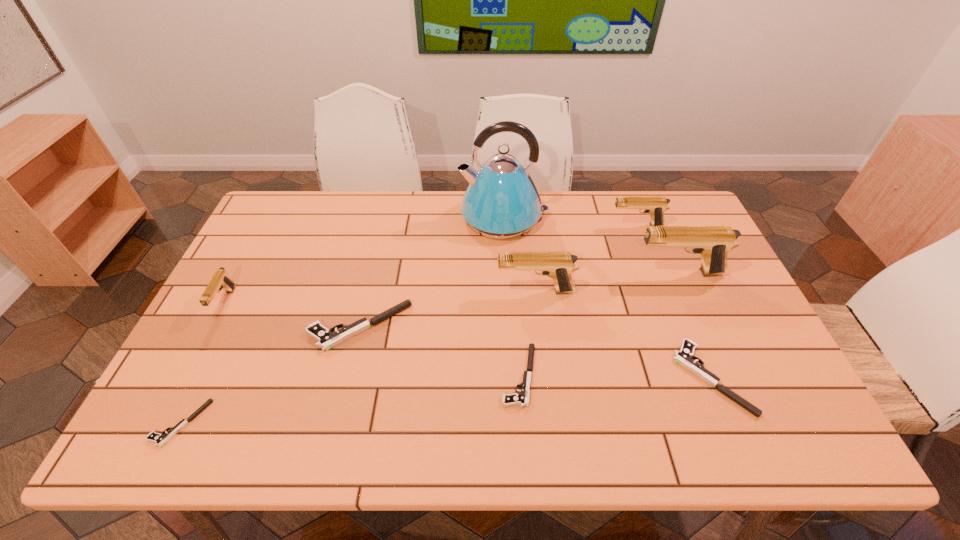
Locate an element on the screen. free space located at the barrel of the biggest tan pistol is located at coordinates (603, 273).

This screenshot has width=960, height=540. Find the location of `vacant space situated at the barrel of the biggest tan pistol`. vacant space situated at the barrel of the biggest tan pistol is located at coordinates (519, 273).

Where is `free spot located 0.080m at the barrel of the biggest tan pistol`? This screenshot has height=540, width=960. free spot located 0.080m at the barrel of the biggest tan pistol is located at coordinates [607, 273].

The height and width of the screenshot is (540, 960). In order to click on free space located at the barrel of the seventh shortest pistol in this screenshot , I will do `click(389, 291)`.

Locate an element on the screen. Image resolution: width=960 pixels, height=540 pixels. free spot located at the barrel of the seventh shortest pistol is located at coordinates (455, 291).

Locate an element on the screen. The width and height of the screenshot is (960, 540). vacant area situated 0.070m at the barrel of the seventh shortest pistol is located at coordinates (472, 291).

Find the location of a particular element. free space located at the barrel of the fourth tallest object is located at coordinates (523, 226).

At what (x,y) coordinates should I click in order to perform the action: click on free space located 0.220m at the barrel of the fourth tallest object. Please return your answer as a coordinate pair (x, y). Looking at the image, I should click on (543, 226).

Image resolution: width=960 pixels, height=540 pixels. What are the coordinates of `vacant position located 0.250m at the barrel of the fourth tallest object` in the screenshot? It's located at (535, 226).

Locate an element on the screen. The image size is (960, 540). free point located at the barrel of the leftmost tan pistol is located at coordinates (180, 387).